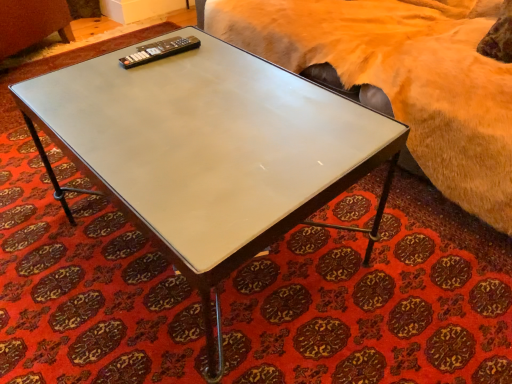
I want to click on free location in front of black plastic remote at upper left, so click(150, 79).